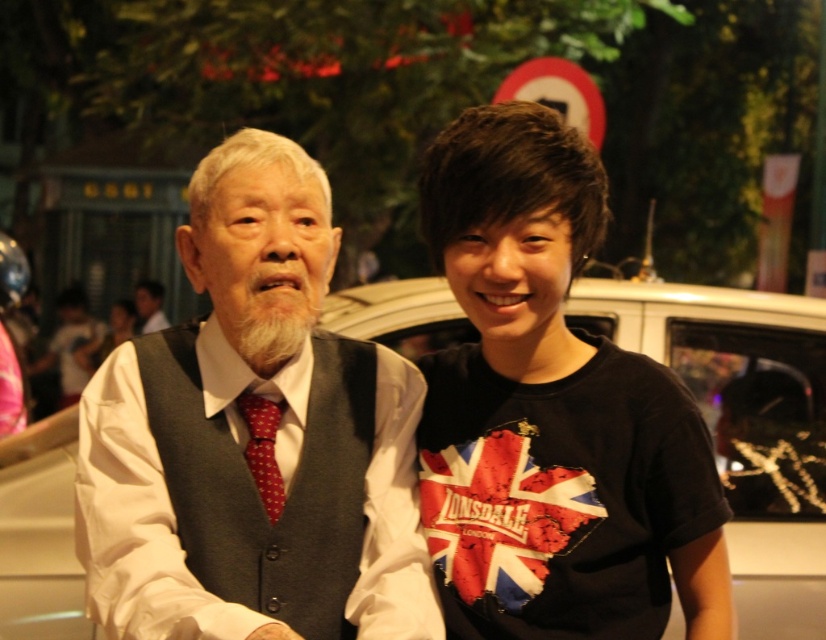
Is gray wool vest at center positioned in front of white shirt at center?

Yes, gray wool vest at center is in front of white shirt at center.

Which is below, gray wool vest at center or white shirt at center?

gray wool vest at center is lower down.

Measure the distance between gray wool vest at center and camera.

gray wool vest at center and camera are 6.92 feet apart.

I want to click on gray wool vest at center, so click(x=247, y=438).

Which is more to the right, gray wool vest at center or white glossy car at center?

Positioned to the right is white glossy car at center.

This screenshot has width=826, height=640. Describe the element at coordinates (247, 438) in the screenshot. I see `gray wool vest at center` at that location.

The width and height of the screenshot is (826, 640). Find the location of `gray wool vest at center`. gray wool vest at center is located at coordinates (247, 438).

Can you confirm if dark gray knitted vest at center is positioned to the left of union jack fabric at center?

Indeed, dark gray knitted vest at center is positioned on the left side of union jack fabric at center.

From the picture: Can you confirm if dark gray knitted vest at center is shorter than union jack fabric at center?

Incorrect, dark gray knitted vest at center's height does not fall short of union jack fabric at center's.

Is point (228, 547) more distant than point (477, 458)?

No, (228, 547) is in front of (477, 458).

You are a GUI agent. You are given a task and a screenshot of the screen. Output one action in this format:
    pyautogui.click(x=<x>, y=<y>)
    Task: Click on the dark gray knitted vest at center
    
    Given the screenshot: What is the action you would take?
    click(255, 490)